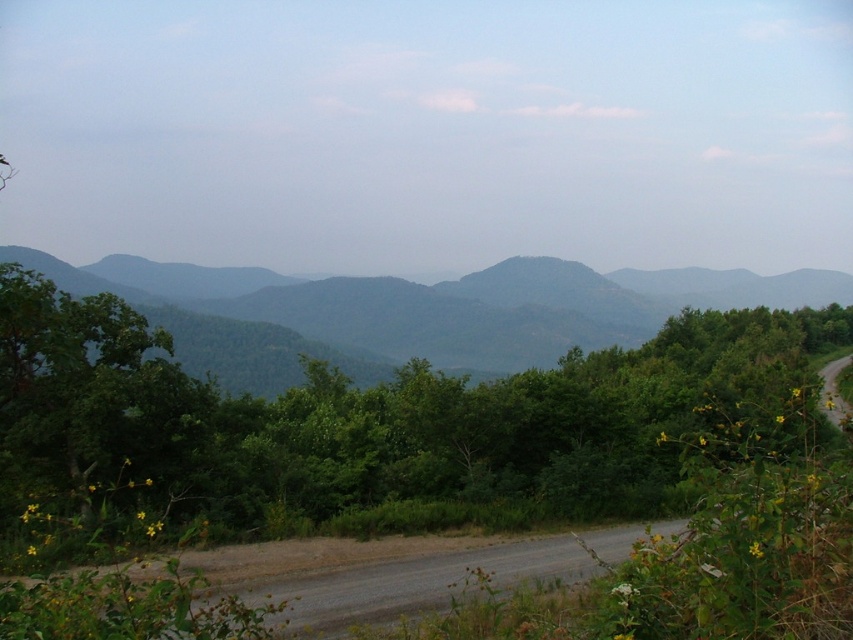
Is point (722, 381) more distant than point (305, 326)?

No, (722, 381) is closer to viewer.

Which is behind, point (292, 509) or point (181, 333)?

Positioned behind is point (181, 333).

This screenshot has height=640, width=853. Find the location of `green leafy tree at center`. green leafy tree at center is located at coordinates (357, 426).